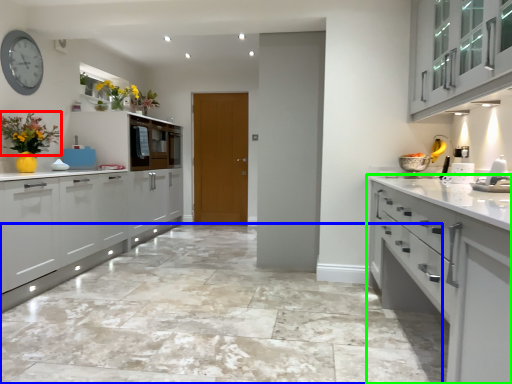
Question: Based on their relative distances, which object is nearer to floral arrangement (highlighted by a red box)? Choose from granite (highlighted by a blue box) and cabinetry (highlighted by a green box).

Choices:
 (A) granite
 (B) cabinetry

Answer: (A)